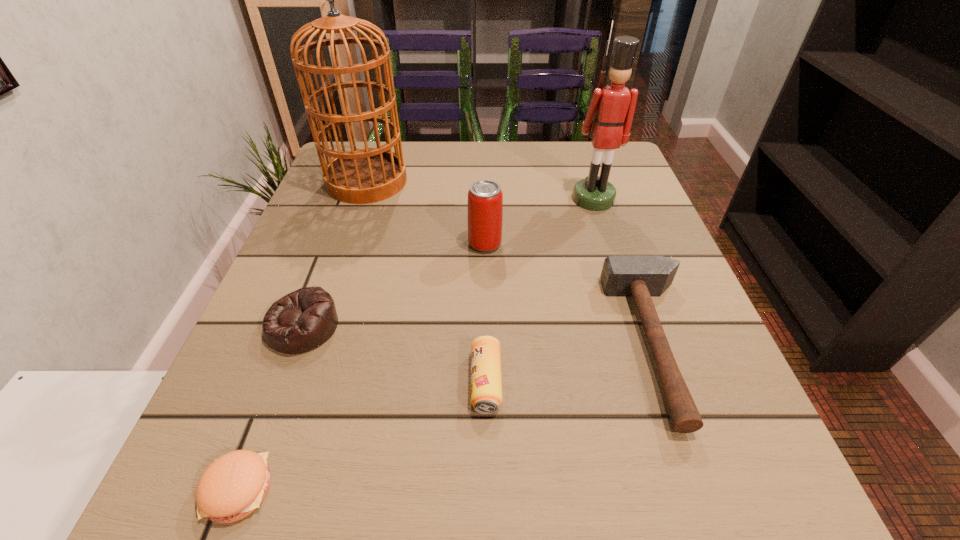
In the image, there is a desktop. Find the location of `vacant space at the left edge`. vacant space at the left edge is located at coordinates (337, 273).

I want to click on free space at the right edge of the desktop, so click(x=761, y=454).

In order to click on free space at the far left corner of the desktop in this screenshot , I will do `click(369, 146)`.

Where is `unoccupied position between the birdcage and the beanbag`? Image resolution: width=960 pixels, height=540 pixels. unoccupied position between the birdcage and the beanbag is located at coordinates (335, 254).

Where is `free spot between the nearer beer can and the farther beer can`? free spot between the nearer beer can and the farther beer can is located at coordinates (486, 313).

The height and width of the screenshot is (540, 960). Identify the location of unoccupied position between the fifth nearest object and the tallest object. (426, 213).

Locate an element on the screen. The image size is (960, 540). vacant area that lies between the beanbag and the tallest object is located at coordinates (335, 254).

Find the location of a particular element. free area in between the tallest object and the hammer is located at coordinates (513, 262).

Where is `vacant space that is in between the nutcracker and the beanbag`? The image size is (960, 540). vacant space that is in between the nutcracker and the beanbag is located at coordinates (448, 262).

Where is `unoccupied position between the nearest object and the nutcracker`? unoccupied position between the nearest object and the nutcracker is located at coordinates (416, 344).